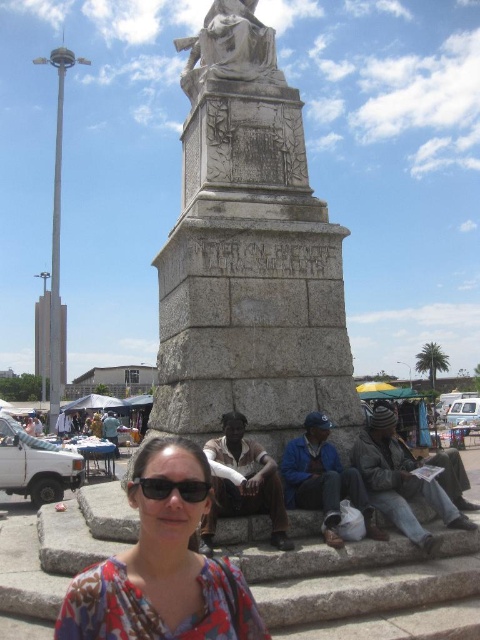
Can you confirm if gray stone monument at center is shorter than floral fabric blouse at lower center?

Incorrect, gray stone monument at center's height does not fall short of floral fabric blouse at lower center's.

Can you confirm if gray stone monument at center is positioned to the left of floral fabric blouse at lower center?

Yes, gray stone monument at center is to the left of floral fabric blouse at lower center.

Between point (252, 420) and point (144, 497), which one is positioned in front?

Positioned in front is point (144, 497).

Identify the location of gray stone monument at center. Image resolution: width=480 pixels, height=640 pixels. (248, 253).

Is floral fabric blouse at lower center to the right of black plastic sunglasses at center from the viewer's perspective?

No, floral fabric blouse at lower center is not to the right of black plastic sunglasses at center.

Who is lower down, floral fabric blouse at lower center or black plastic sunglasses at center?

floral fabric blouse at lower center is below.

Find the location of a particular element. Image resolution: width=480 pixels, height=640 pixels. floral fabric blouse at lower center is located at coordinates (163, 564).

Does gray stone monument at center appear on the left side of black plastic sunglasses at center?

Yes, gray stone monument at center is to the left of black plastic sunglasses at center.

You are a GUI agent. You are given a task and a screenshot of the screen. Output one action in this format:
    pyautogui.click(x=<x>, y=<y>)
    Task: Click on the gray stone monument at center
    This screenshot has width=480, height=640.
    Given the screenshot: What is the action you would take?
    pyautogui.click(x=248, y=253)

Between point (195, 116) and point (184, 484), which one is positioned in front?

Point (184, 484) is more forward.

Where is `gray stone monument at center`? This screenshot has height=640, width=480. gray stone monument at center is located at coordinates (248, 253).